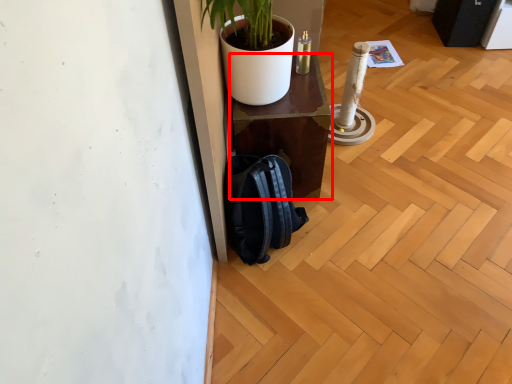
Question: Observing the image, what is the correct spatial positioning of furniture (annotated by the red box) in reference to backpack?

Choices:
 (A) right
 (B) left

Answer: (A)